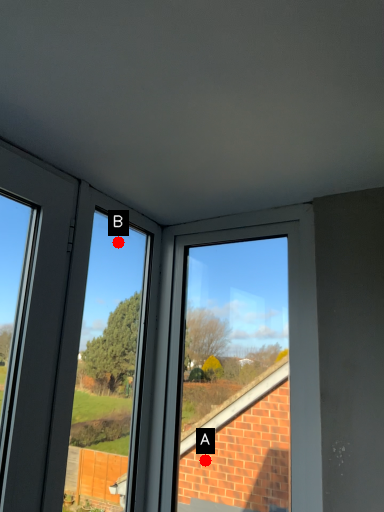
Question: Two points are circled on the image, labeled by A and B beside each circle. Among these points, which one is farthest from the camera?

Choices:
 (A) A is further
 (B) B is further

Answer: (B)